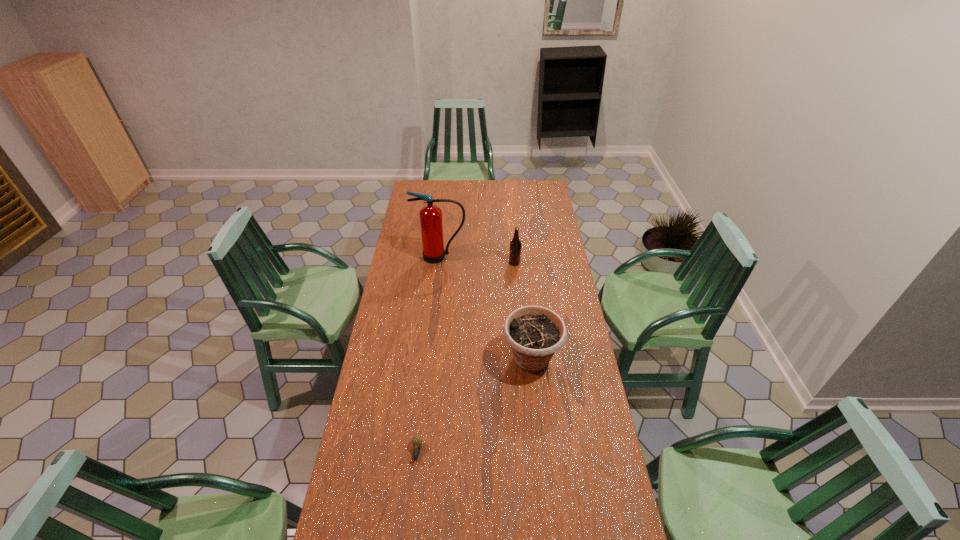
You are a GUI agent. You are given a task and a screenshot of the screen. Output one action in this format:
    pyautogui.click(x=<x>, y=<y>)
    Task: Click on the fire extinguisher
    
    Given the screenshot: What is the action you would take?
    pyautogui.click(x=431, y=222)

Find the location of a particular element. This screenshot has width=960, height=540. beer bottle is located at coordinates (515, 244).

In order to click on the second nearest object in this screenshot , I will do `click(534, 333)`.

In order to click on escargot in this screenshot , I will do `click(416, 440)`.

Where is `the shortest object`? The image size is (960, 540). the shortest object is located at coordinates (x=416, y=440).

Where is `vacant space situated 0.140m on the right of the tallest object`? The width and height of the screenshot is (960, 540). vacant space situated 0.140m on the right of the tallest object is located at coordinates (492, 256).

The image size is (960, 540). What are the coordinates of `blank area located on the label of the beer bottle` in the screenshot? It's located at (437, 263).

This screenshot has height=540, width=960. I want to click on free space located 0.110m on the label of the beer bottle, so click(488, 263).

Locate an element on the screen. vacant space situated 0.190m on the label of the beer bottle is located at coordinates (472, 263).

In order to click on vacant area situated on the left of the flowerpot in this screenshot , I will do `click(459, 359)`.